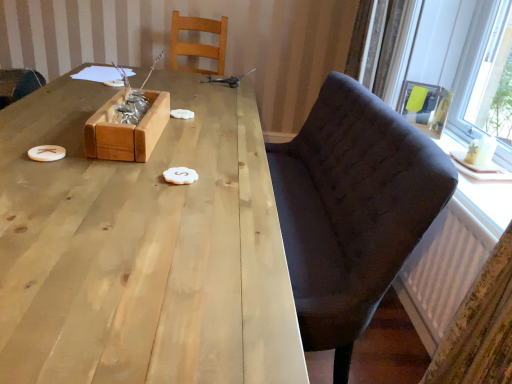
This screenshot has height=384, width=512. Describe the element at coordinates (143, 248) in the screenshot. I see `natural wood table at center` at that location.

At what (x,y) coordinates should I click in order to perform the action: click on natural wood table at center. Please return your answer as a coordinate pair (x, y). The height and width of the screenshot is (384, 512). Looking at the image, I should click on 143,248.

How much space does wooden chair at upper center, which is counted as the 2th chair, starting from the right, occupy horizontally?

20.81 inches.

The width and height of the screenshot is (512, 384). I want to click on wooden chair at left, the first chair in the left-to-right sequence, so click(x=18, y=84).

At what (x,y) coordinates should I click in order to perform the action: click on white matte cookie at center, the second food in the left-to-right sequence. Please return your answer as a coordinate pair (x, y). Looking at the image, I should click on (180, 175).

Is point (170, 169) behind point (291, 370)?

Yes, point (170, 169) is behind point (291, 370).

Does white matte cookie at center, marked as the 1th food in a bottom-to-top arrangement, have a smaller size compared to natural wood table at center?

Indeed, white matte cookie at center, marked as the 1th food in a bottom-to-top arrangement, has a smaller size compared to natural wood table at center.

Considering the relative sizes of white matte cookie at center, which is the second food from top to bottom, and natural wood table at center in the image provided, is white matte cookie at center, which is the second food from top to bottom, taller than natural wood table at center?

No.

From a real-world perspective, relative to natural wood table at center, is white matte cookie at center, the first food in the right-to-left sequence, vertically above or below?

From a real-world perspective, white matte cookie at center, the first food in the right-to-left sequence, is physically above natural wood table at center.

Is transparent glass window at upper right completely or partially inside natural wood table at center?

No.

From a real-world perspective, is natural wood table at center below transparent glass window at upper right?

Indeed, from a real-world perspective, natural wood table at center is positioned beneath transparent glass window at upper right.

Can you confirm if natural wood table at center is shorter than transparent glass window at upper right?

Incorrect, the height of natural wood table at center does not fall short of that of transparent glass window at upper right.

From the image's perspective, which is above, natural wood table at center or transparent glass window at upper right?

transparent glass window at upper right is shown above in the image.

At what (x,y) coordinates should I click in order to perform the action: click on armchair on the right of natural wood table at center. Please return your answer as a coordinate pair (x, y). The width and height of the screenshot is (512, 384). Looking at the image, I should click on (426, 107).

Is matte black armchair at upper right far away from natural wood table at center?

Yes, matte black armchair at upper right is far from natural wood table at center.

From the picture: Which point is more forward, (433, 111) or (79, 143)?

The point (79, 143) is closer.

Considering the relative sizes of matte black armchair at upper right and natural wood table at center in the image provided, is matte black armchair at upper right wider than natural wood table at center?

No.

Which is behind, point (330, 259) or point (108, 314)?

The point (330, 259) is farther from the camera.

From a real-world perspective, which chair is the 2nd one above the natural wood table at center? Please provide its 2D coordinates.

[(352, 210)]

Is dark fabric chair at right, which ranks as the 1th chair in right-to-left order, oriented towards natural wood table at center?

Yes, dark fabric chair at right, which ranks as the 1th chair in right-to-left order, is oriented towards natural wood table at center.

Between dark fabric chair at right, which ranks as the 1th chair in right-to-left order, and natural wood table at center, which one has smaller width?

dark fabric chair at right, which ranks as the 1th chair in right-to-left order, is thinner.

From the image's perspective, does wooden box at center appear lower than natural wood table at center?

No, from the image's perspective, wooden box at center is not below natural wood table at center.

Consider the image. Can you confirm if wooden box at center is bigger than natural wood table at center?

No.

Is wooden box at center taller than natural wood table at center?

No.

How much distance is there between wooden box at center and natural wood table at center?

wooden box at center and natural wood table at center are 25.09 centimeters apart from each other.

The width and height of the screenshot is (512, 384). I want to click on chair in front of the wooden chair at upper center, which is counted as the 2th chair, starting from the right, so click(352, 210).

From the image's perspective, which is above, wooden chair at upper center, which is counted as the 2th chair, starting from the right, or dark fabric chair at right, which ranks as the 1th chair in right-to-left order?

wooden chair at upper center, which is counted as the 2th chair, starting from the right, appears higher in the image.

Who is shorter, wooden chair at upper center, the 2th chair viewed from the left, or dark fabric chair at right, which ranks as the 1th chair in right-to-left order?

→ Standing shorter between the two is wooden chair at upper center, the 2th chair viewed from the left.

Is wooden chair at upper center, which is counted as the 2th chair, starting from the right, placed right next to dark fabric chair at right, the third chair positioned from the left?

No, wooden chair at upper center, which is counted as the 2th chair, starting from the right, is not in contact with dark fabric chair at right, the third chair positioned from the left.

At what (x,y) coordinates should I click in order to perform the action: click on chair that is the 2nd one when counting backward from the white matte cookie at center, the first food in the left-to-right sequence. Please return your answer as a coordinate pair (x, y). The width and height of the screenshot is (512, 384). Looking at the image, I should click on (x=18, y=84).

Looking at their sizes, would you say wooden chair at left, which ranks as the third chair in right-to-left order, is wider or thinner than white matte cookie at center, arranged as the 1th food when viewed from the back?

Considering their sizes, wooden chair at left, which ranks as the third chair in right-to-left order, looks broader than white matte cookie at center, arranged as the 1th food when viewed from the back.

Is wooden chair at left, which ranks as the third chair in right-to-left order, facing towards white matte cookie at center, the first food in the left-to-right sequence?

No, wooden chair at left, which ranks as the third chair in right-to-left order, is not aimed at white matte cookie at center, the first food in the left-to-right sequence.

Is point (12, 102) positioned before point (189, 113)?

That is True.

Where is `food that is the 1st object above the natural wood table at center (from a real-world perspective)`? Image resolution: width=512 pixels, height=384 pixels. food that is the 1st object above the natural wood table at center (from a real-world perspective) is located at coordinates (180, 175).

This screenshot has width=512, height=384. I want to click on window behind the natural wood table at center, so click(463, 59).

Which object lies further to the anchor point matte black armchair at upper right, wooden box at center or white matte cookie at center, arranged as the 1th food when viewed from the back?

wooden box at center.

Considering their positions, is dark fabric chair at right, the third chair positioned from the left, positioned further to matte black armchair at upper right than transparent glass window at upper right?

dark fabric chair at right, the third chair positioned from the left.

Estimate the real-world distances between objects in this image. Which object is closer to wooden chair at upper center, the 2th chair viewed from the left, matte black armchair at upper right or white matte cookie at center, the first food in the right-to-left sequence?

The object closer to wooden chair at upper center, the 2th chair viewed from the left, is matte black armchair at upper right.

Based on the photo, from the image, which object appears to be nearer to dark fabric chair at right, which ranks as the 1th chair in right-to-left order, matte black armchair at upper right or natural wood table at center?

The object closer to dark fabric chair at right, which ranks as the 1th chair in right-to-left order, is natural wood table at center.

Based on their spatial positions, is white matte cookie at center, marked as the 1th food in a bottom-to-top arrangement, or dark fabric chair at right, which ranks as the 1th chair in right-to-left order, further from wooden box at center?

dark fabric chair at right, which ranks as the 1th chair in right-to-left order, is positioned further to the anchor wooden box at center.

Consider the image. Considering their positions, is matte black armchair at upper right positioned closer to white matte cookie at center, marked as the second food in a right-to-left arrangement, than wooden box at center?

Among the two, wooden box at center is located nearer to white matte cookie at center, marked as the second food in a right-to-left arrangement.

Looking at the image, which one is located further to wooden chair at left, the first chair in the left-to-right sequence, wooden box at center or natural wood table at center?

natural wood table at center lies further to wooden chair at left, the first chair in the left-to-right sequence, than the other object.

Looking at the image, which one is located closer to wooden chair at left, which ranks as the third chair in right-to-left order, matte black armchair at upper right or wooden chair at upper center, the 2th chair viewed from the left?

wooden chair at upper center, the 2th chair viewed from the left, is positioned closer to the anchor wooden chair at left, which ranks as the third chair in right-to-left order.

The width and height of the screenshot is (512, 384). Identify the location of chair located between white matte cookie at center, arranged as the 1th food when viewed from the back, and transparent glass window at upper right in the left-right direction. (352, 210).

Where is `window between natural wood table at center and wooden chair at upper center, the 2th chair viewed from the left, in the front-back direction`? The image size is (512, 384). window between natural wood table at center and wooden chair at upper center, the 2th chair viewed from the left, in the front-back direction is located at coordinates (463, 59).

I want to click on armchair positioned between natural wood table at center and wooden chair at upper center, the 2th chair viewed from the left, from near to far, so click(426, 107).

Identify the location of chair located between wooden chair at left, the first chair in the left-to-right sequence, and white matte cookie at center, the first food in the left-to-right sequence, in the left-right direction. (198, 43).